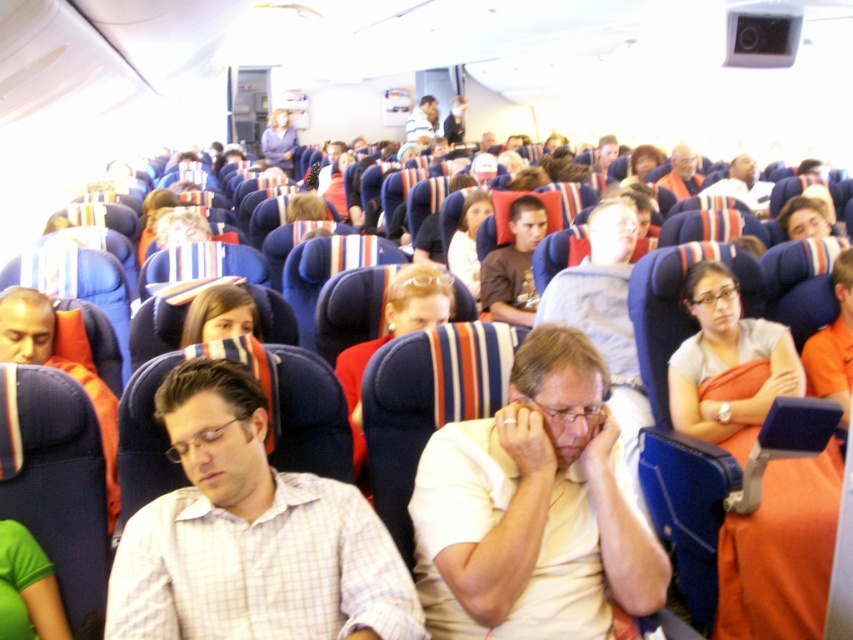
You are a flight attendant on an airplane and need to locate the brown matte shirt at center. According to the cabin coordinates, where would you find it?

The brown matte shirt at center is located at coordinates point [514,266].

You are a flight attendant carrying a food cart that is 2 meters long. You need to move from the back of the airplane cabin to the front. Is there enough space between the brown matte shirt at center and the matte orange shirt at upper right for your cart to pass through?

The distance between the brown matte shirt at center and the matte orange shirt at upper right is 2.41 meters. Since the cart is 2 meters long, there is sufficient space for it to pass through.

You are a flight attendant checking the seating arrangement. You notice two passengers sitting at the center of the airplane cabin wearing white matte shirt at center and brown matte shirt at center. Which passenger is sitting closer to the front of the airplane?

The white matte shirt at center is shorter than brown matte shirt at center, so the passenger wearing the white matte shirt at center is sitting closer to the front of the airplane.